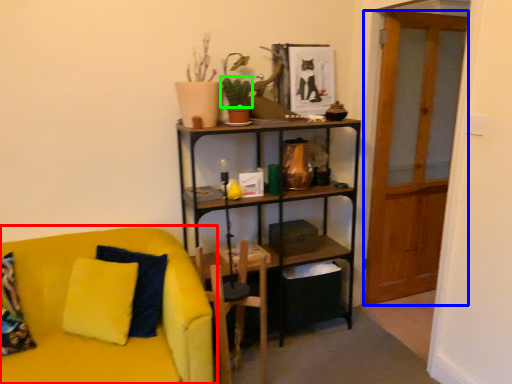
Question: Which object is the closest to the studio couch (highlighted by a red box)? Choose among these: glass door (highlighted by a blue box) or plant (highlighted by a green box).

Choices:
 (A) glass door
 (B) plant

Answer: (B)